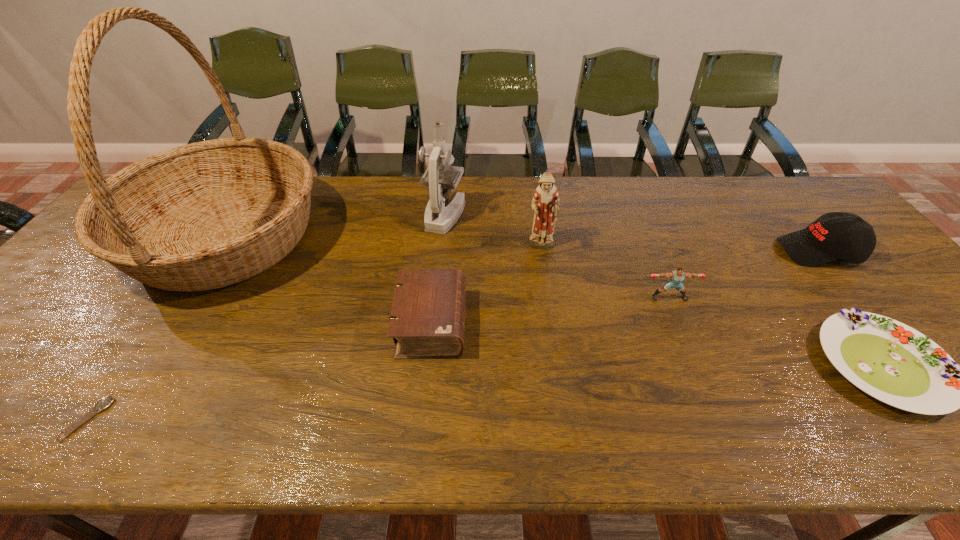
You are a GUI agent. You are given a task and a screenshot of the screen. Output one action in this format:
    pyautogui.click(x=<x>, y=<y>)
    Task: Click on the blank region between the fifth tallest object and the figurine
    The width and height of the screenshot is (960, 540).
    Given the screenshot: What is the action you would take?
    pyautogui.click(x=605, y=272)

Where is `free space between the third shortest object and the sixth object from left to right`? free space between the third shortest object and the sixth object from left to right is located at coordinates (550, 310).

Identify the location of vacant space that's between the tallest object and the sixth object from left to right. (447, 267).

The width and height of the screenshot is (960, 540). I want to click on vacant space that's between the figurine and the microscope, so click(493, 231).

This screenshot has width=960, height=540. In order to click on unoccupied position between the third object from right to left and the shortest object in this screenshot , I will do `click(378, 358)`.

Locate which object is the closest to the Bible. Please provide its 2D coordinates. Your answer should be formatted as a tuple, i.e. [(x, y)], where the tuple contains the x and y coordinates of a point satisfying the conditions above.

[(545, 205)]

Select which object is the fifth closest to the baseball cap. Please provide its 2D coordinates. Your answer should be formatted as a tuple, i.e. [(x, y)], where the tuple contains the x and y coordinates of a point satisfying the conditions above.

[(439, 219)]

Where is `free space that satisfies the following two spatial constraints: 1. on the front-facing side of the baseball cap; 2. on the front-facing side of the puncher`? This screenshot has height=540, width=960. free space that satisfies the following two spatial constraints: 1. on the front-facing side of the baseball cap; 2. on the front-facing side of the puncher is located at coordinates (856, 298).